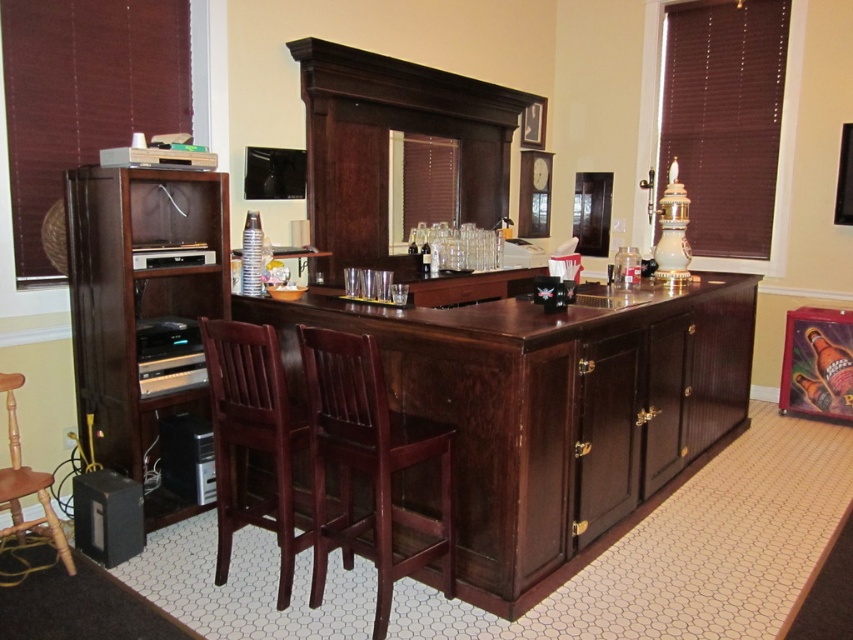
You are a guest at a party and want to sit down at the bar. You see the dark wood counter top at center and the light brown wood bar stool at lower left. Which object should you approach to sit?

You should approach the light brown wood bar stool at lower left because it is a seating option, while the dark wood counter top at center is a surface for placing items.

You are a guest at a party and want to sit down at the bar. You see the brown wood chair at center and the dark wood drawer at center. Which object should you interact with to sit?

You should interact with the brown wood chair at center to sit because it is a chair, while the dark wood drawer at center is a drawer located above it.

You are hosting a dinner party and need to seat guests. You have a brown wood chair at center and a dark wood drawer at center. Which object can you use to seat more guests?

The brown wood chair at center is bigger than the dark wood drawer at center, so it can seat more guests.